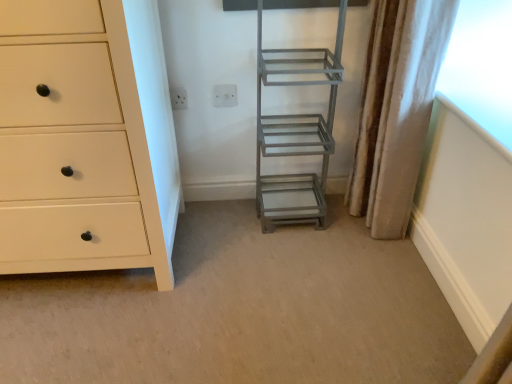
Question: From a real-world perspective, is metallic gray ladder at center physically above silky beige curtain at right?

Choices:
 (A) yes
 (B) no

Answer: (B)

Question: Is metallic gray ladder at center not within silky beige curtain at right?

Choices:
 (A) no
 (B) yes

Answer: (B)

Question: Is metallic gray ladder at center aimed at silky beige curtain at right?

Choices:
 (A) yes
 (B) no

Answer: (B)

Question: From a real-world perspective, is metallic gray ladder at center below silky beige curtain at right?

Choices:
 (A) no
 (B) yes

Answer: (B)

Question: Can you confirm if metallic gray ladder at center is shorter than silky beige curtain at right?

Choices:
 (A) yes
 (B) no

Answer: (A)

Question: Considering the relative sizes of metallic gray ladder at center and silky beige curtain at right in the image provided, is metallic gray ladder at center bigger than silky beige curtain at right?

Choices:
 (A) no
 (B) yes

Answer: (B)

Question: Is silky beige curtain at right to the left of white matte chest of drawers at left from the viewer's perspective?

Choices:
 (A) yes
 (B) no

Answer: (B)

Question: Considering the relative sizes of silky beige curtain at right and white matte chest of drawers at left in the image provided, is silky beige curtain at right bigger than white matte chest of drawers at left?

Choices:
 (A) no
 (B) yes

Answer: (A)

Question: Considering the relative sizes of silky beige curtain at right and white matte chest of drawers at left in the image provided, is silky beige curtain at right shorter than white matte chest of drawers at left?

Choices:
 (A) yes
 (B) no

Answer: (A)

Question: Is silky beige curtain at right facing away from white matte chest of drawers at left?

Choices:
 (A) no
 (B) yes

Answer: (A)

Question: From a real-world perspective, is silky beige curtain at right positioned under white matte chest of drawers at left based on gravity?

Choices:
 (A) no
 (B) yes

Answer: (B)

Question: Is silky beige curtain at right far from white matte chest of drawers at left?

Choices:
 (A) no
 (B) yes

Answer: (A)

Question: Can you confirm if white plastic electric outlet at upper center, acting as the second electric outlet starting from the right, is taller than white plastic electric outlet at upper center, the 2th electric outlet when ordered from left to right?

Choices:
 (A) no
 (B) yes

Answer: (A)